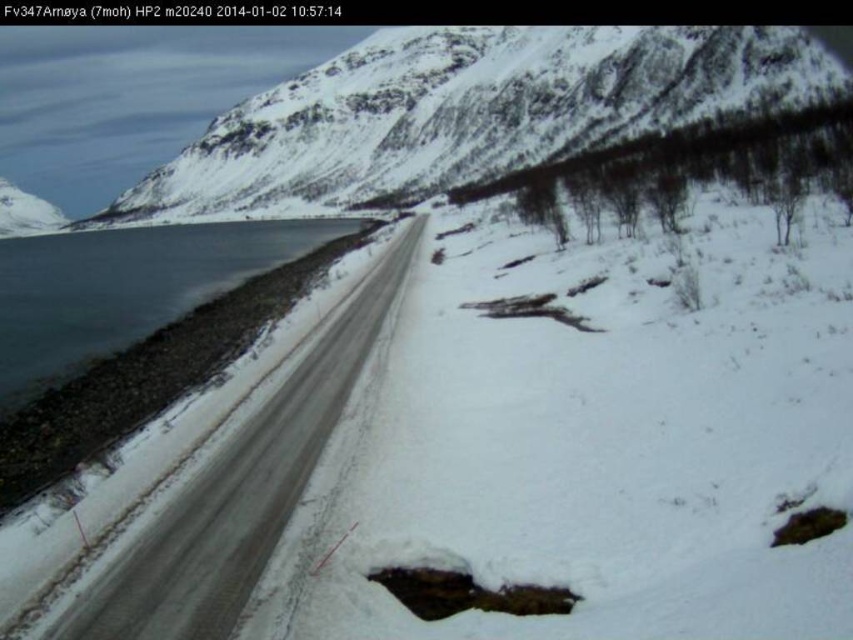
You are driving a truck that is 3 meters wide. You need to navigate through the snowy asphalt road at left while avoiding the snowy rock at upper center. Can your truck safely pass through the road without hitting the rock?

The snowy rock at upper center is to the right of the snowy asphalt road at left, so the truck can safely pass through the road as the rock is positioned away from the road on the right side. However, ensure to stay within the road boundaries marked by tire tracks to avoid any obstacles.

You are a hiker planning to take a photo of the snowy rock at upper center from your current position. Given that your camera can focus on objects up to 200 meters away, will you need to adjust your position to capture a clear photo?

The snowy rock at upper center is 203.93 meters away from the camera, which exceeds the camera focus range of 200 meters. Therefore, you need to move closer to ensure the snowy rock at upper center is within the focus range.

You are a hiker planning to cross the snowy landscape shown in the image. You need to reach a specific point marked as point (473, 112). Based on the scene description, where exactly is this point located?

The point (473, 112) is located on snowy rock at upper center.